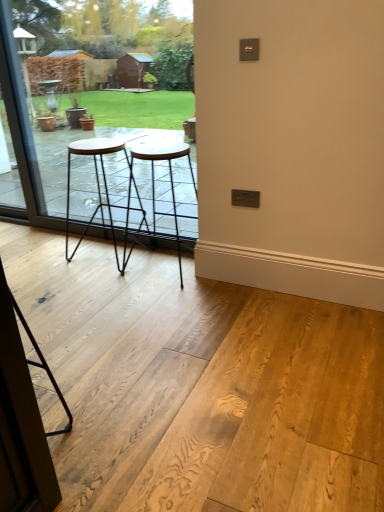
Question: Would you say black metal stool at center, the first stool when ordered from right to left, is outside transparent glass screen door at lower left?

Choices:
 (A) no
 (B) yes

Answer: (B)

Question: From the image's perspective, is black metal stool at center, the first stool when ordered from right to left, located above transparent glass screen door at lower left?

Choices:
 (A) no
 (B) yes

Answer: (B)

Question: Does black metal stool at center, the second stool from the left, contain transparent glass screen door at lower left?

Choices:
 (A) yes
 (B) no

Answer: (B)

Question: From the image's perspective, is black metal stool at center, the second stool from the left, under transparent glass screen door at lower left?

Choices:
 (A) yes
 (B) no

Answer: (B)

Question: Are black metal stool at center, the second stool from the left, and transparent glass screen door at lower left located far from each other?

Choices:
 (A) no
 (B) yes

Answer: (B)

Question: Considering the positions of point (39, 503) and point (114, 146), is point (39, 503) closer or farther from the camera than point (114, 146)?

Choices:
 (A) farther
 (B) closer

Answer: (B)

Question: Looking at their shapes, would you say transparent glass screen door at lower left is wider or thinner than wooden stool at center, positioned as the 1th stool in left-to-right order?

Choices:
 (A) wide
 (B) thin

Answer: (B)

Question: From the image's perspective, is transparent glass screen door at lower left above or below wooden stool at center, marked as the 2th stool in a right-to-left arrangement?

Choices:
 (A) above
 (B) below

Answer: (B)

Question: From their relative heights in the image, would you say transparent glass screen door at lower left is taller or shorter than wooden stool at center, marked as the 2th stool in a right-to-left arrangement?

Choices:
 (A) short
 (B) tall

Answer: (B)

Question: Is wooden stool at center, marked as the 2th stool in a right-to-left arrangement, wider or thinner than transparent glass screen door at lower left?

Choices:
 (A) thin
 (B) wide

Answer: (B)

Question: Is point (67, 195) positioned closer to the camera than point (31, 468)?

Choices:
 (A) farther
 (B) closer

Answer: (A)

Question: In terms of height, does wooden stool at center, positioned as the 1th stool in left-to-right order, look taller or shorter compared to transparent glass screen door at lower left?

Choices:
 (A) tall
 (B) short

Answer: (B)

Question: In the image, is wooden stool at center, marked as the 2th stool in a right-to-left arrangement, on the left side or the right side of transparent glass screen door at lower left?

Choices:
 (A) right
 (B) left

Answer: (A)

Question: From the image's perspective, is black metal stool at center, the second stool from the left, above or below transparent glass screen door at lower left?

Choices:
 (A) above
 (B) below

Answer: (A)

Question: Does point 132,161 appear closer or farther from the camera than point 26,504?

Choices:
 (A) closer
 (B) farther

Answer: (B)